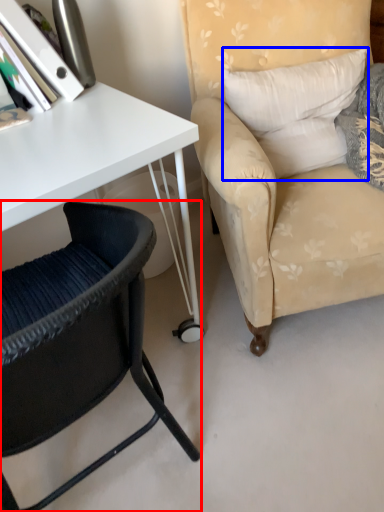
Question: Among these objects, which one is farthest to the camera, chair (highlighted by a red box) or pillow (highlighted by a blue box)?

Choices:
 (A) chair
 (B) pillow

Answer: (B)